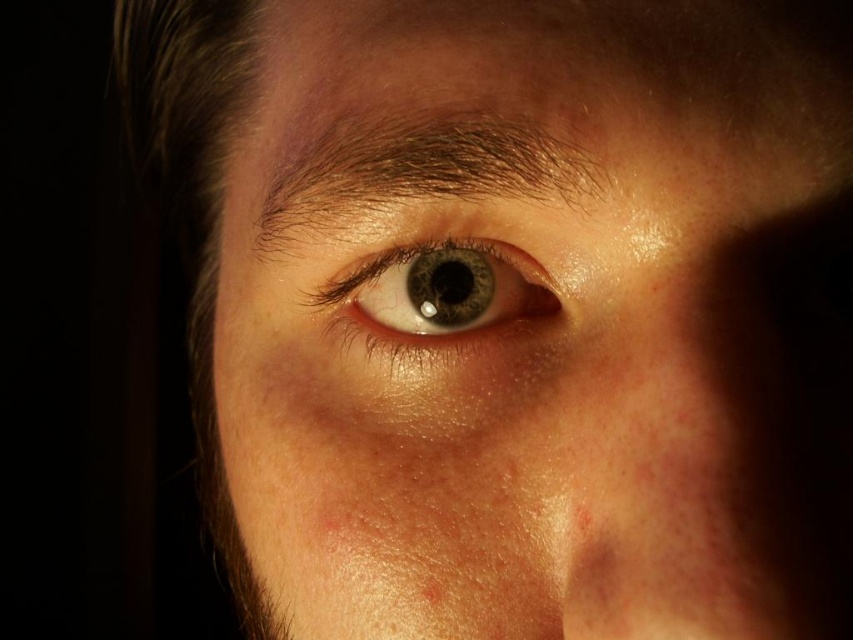
Question: Considering the relative positions of shiny blue eye at center and brown matte freckle at lower center in the image provided, where is shiny blue eye at center located with respect to brown matte freckle at lower center?

Choices:
 (A) right
 (B) left

Answer: (B)

Question: Can you confirm if shiny blue eye at center is smaller than brown matte freckle at lower center?

Choices:
 (A) no
 (B) yes

Answer: (A)

Question: Which of these objects is positioned closest to the brown matte freckle at lower center?

Choices:
 (A) shiny blue eye at center
 (B) smooth skin eye at center

Answer: (A)

Question: Among these points, which one is nearest to the camera?

Choices:
 (A) (432, 584)
 (B) (306, 301)
 (C) (450, 285)

Answer: (A)

Question: Which point appears closest to the camera in this image?

Choices:
 (A) (432, 593)
 (B) (840, 99)
 (C) (506, 262)

Answer: (B)

Question: Is the position of smooth skin eye at center more distant than that of brown matte freckle at lower center?

Choices:
 (A) no
 (B) yes

Answer: (A)